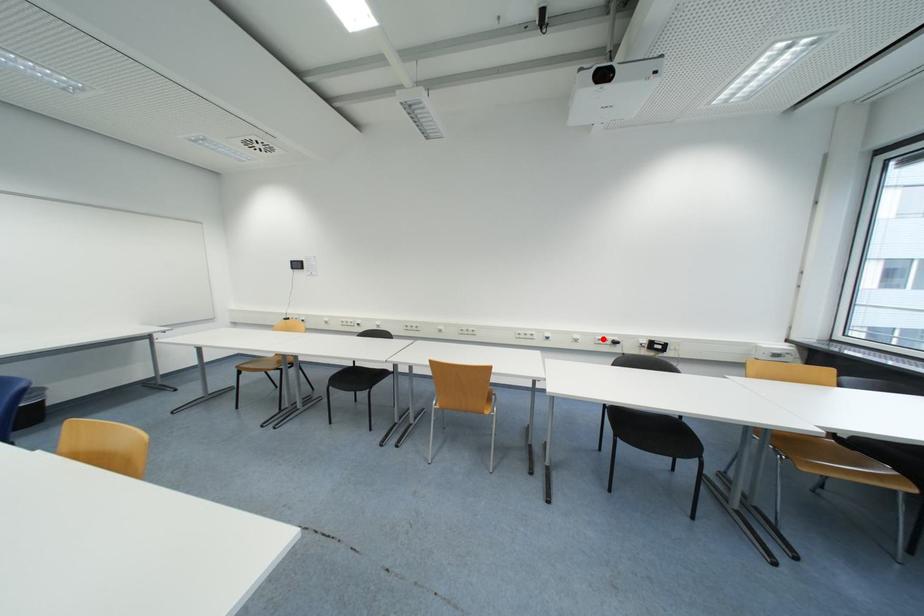
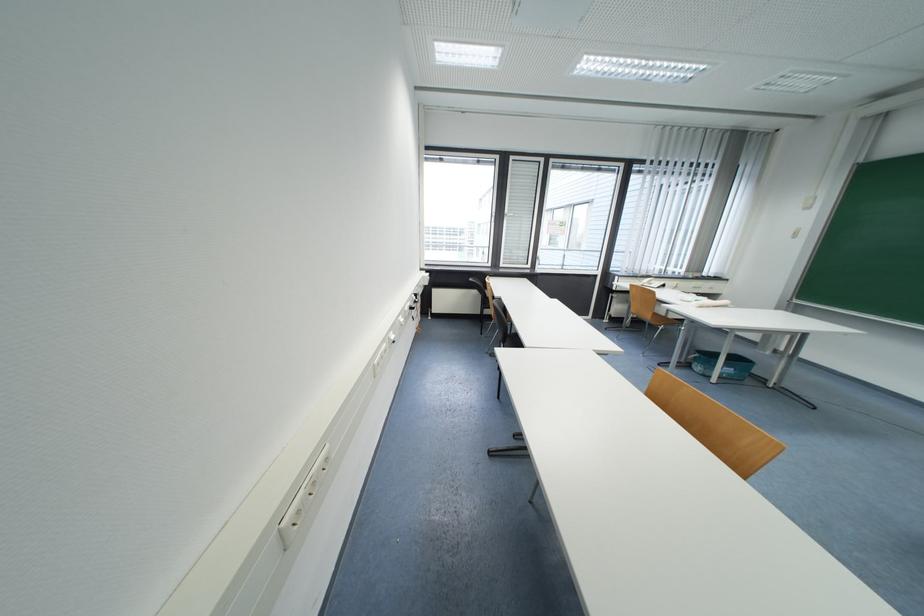
Locate, in the second image, the point that corresponds to the highlighted location in the first image.

(411, 310)